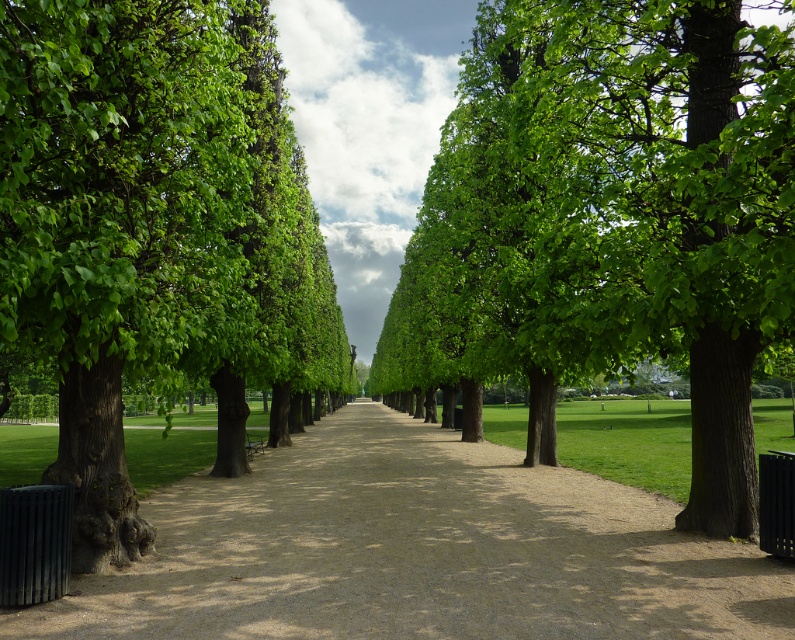
Question: Based on their relative distances, which object is farther from the green leafy tree at center?

Choices:
 (A) wooden park bench at center
 (B) brown gravel path at center
 (C) green leafy tree at left

Answer: (A)

Question: Is green leafy tree at center closer to the viewer compared to wooden park bench at center?

Choices:
 (A) yes
 (B) no

Answer: (A)

Question: Among these points, which one is nearest to the camera?

Choices:
 (A) (712, 628)
 (B) (198, 339)

Answer: (A)

Question: Can you confirm if brown gravel path at center is positioned to the right of wooden park bench at center?

Choices:
 (A) yes
 (B) no

Answer: (A)

Question: Is green leafy tree at center closer to the viewer compared to green leafy tree at left?

Choices:
 (A) yes
 (B) no

Answer: (B)

Question: Considering the real-world distances, which object is farthest from the green leafy tree at left?

Choices:
 (A) green leafy tree at center
 (B) wooden park bench at center

Answer: (B)